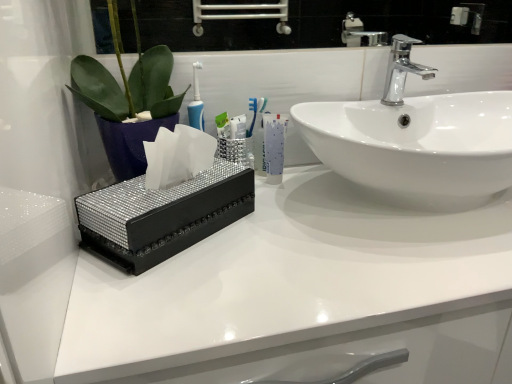
Locate an element on the screen. black glossy tissue box at center is located at coordinates (284, 279).

From the image's perspective, who appears lower, white glossy sink at center or polished chrome faucet at upper right?

white glossy sink at center.

Does white glossy sink at center lie behind polished chrome faucet at upper right?

No, white glossy sink at center is closer to the camera.

From the picture: Between white glossy sink at center and polished chrome faucet at upper right, which one has more height?

Standing taller between the two is white glossy sink at center.

Is black glossy tissue box at center directly adjacent to polished chrome faucet at upper right?

No, black glossy tissue box at center is not in contact with polished chrome faucet at upper right.

From the image's perspective, which one is positioned higher, black glossy tissue box at center or polished chrome faucet at upper right?

polished chrome faucet at upper right.

How many degrees apart are the facing directions of black glossy tissue box at center and polished chrome faucet at upper right?

They differ by 0.105 degrees in their facing directions.

Is black glossy tissue box at center oriented towards polished chrome faucet at upper right?

No, black glossy tissue box at center is not aimed at polished chrome faucet at upper right.

Does point (170, 332) appear closer or farther from the camera than point (398, 194)?

Point (170, 332) is closer to the camera than point (398, 194).

Looking at the image, does black glossy tissue box at center seem bigger or smaller compared to white glossy sink at center?

Considering their sizes, black glossy tissue box at center takes up more space than white glossy sink at center.

Who is shorter, black glossy tissue box at center or white glossy sink at center?

Standing shorter between the two is white glossy sink at center.

Is white glossy sink at center positioned far away from white glossy mouthwash at center?

No.

Does white glossy sink at center have a lesser width compared to white glossy mouthwash at center?

In fact, white glossy sink at center might be wider than white glossy mouthwash at center.

Between white glossy sink at center and white glossy mouthwash at center, which one has larger size?

With larger size is white glossy sink at center.

From the picture: Is sparkly black tissue box at center a part of polished chrome faucet at upper right?

No, polished chrome faucet at upper right does not contain sparkly black tissue box at center.

Who is shorter, polished chrome faucet at upper right or sparkly black tissue box at center?

Standing shorter between the two is polished chrome faucet at upper right.

From the image's perspective, between polished chrome faucet at upper right and sparkly black tissue box at center, who is located below?

sparkly black tissue box at center, from the image's perspective.

Which object is further away from the camera taking this photo, polished chrome faucet at upper right or black glossy tissue box at center?

polished chrome faucet at upper right is further from the camera.

Is black glossy tissue box at center at the back of polished chrome faucet at upper right?

No, black glossy tissue box at center is not at the back of polished chrome faucet at upper right.

Can you confirm if polished chrome faucet at upper right is positioned to the left of black glossy tissue box at center?

Correct, you'll find polished chrome faucet at upper right to the left of black glossy tissue box at center.

Is white glossy mouthwash at center oriented towards sparkly black tissue box at center?

No.

Is sparkly black tissue box at center inside white glossy mouthwash at center?

No, sparkly black tissue box at center is located outside of white glossy mouthwash at center.

Does white glossy mouthwash at center come in front of sparkly black tissue box at center?

No, it is behind sparkly black tissue box at center.

Where is `sink in front of the polished chrome faucet at upper right`? The image size is (512, 384). sink in front of the polished chrome faucet at upper right is located at coordinates (416, 139).

The image size is (512, 384). I want to click on counter top that appears below the polished chrome faucet at upper right (from the image's perspective), so click(284, 279).

When comparing their distances from polished chrome faucet at upper right, does white glossy sink at center or black glossy tissue box at center seem closer?

Based on the image, white glossy sink at center appears to be nearer to polished chrome faucet at upper right.

Considering their positions, is black glossy tissue box at center positioned further to white glossy sink at center than sparkly black tissue box at center?

Based on the image, sparkly black tissue box at center appears to be further to white glossy sink at center.

When comparing their distances from white glossy sink at center, does sparkly black tissue box at center or white glossy mouthwash at center seem further?

sparkly black tissue box at center.

When comparing their distances from polished chrome faucet at upper right, does sparkly black tissue box at center or white glossy sink at center seem closer?

white glossy sink at center lies closer to polished chrome faucet at upper right than the other object.

When comparing their distances from polished chrome faucet at upper right, does black glossy tissue box at center or white glossy sink at center seem further?

Based on the image, black glossy tissue box at center appears to be further to polished chrome faucet at upper right.

Looking at the image, which one is located further to black glossy tissue box at center, white glossy sink at center or polished chrome faucet at upper right?

Among the two, polished chrome faucet at upper right is located further to black glossy tissue box at center.

Considering their positions, is polished chrome faucet at upper right positioned closer to sparkly black tissue box at center than black glossy tissue box at center?

black glossy tissue box at center is closer to sparkly black tissue box at center.

Which object lies nearer to the anchor point white glossy mouthwash at center, sparkly black tissue box at center or polished chrome faucet at upper right?

sparkly black tissue box at center is closer to white glossy mouthwash at center.

Identify the location of sink that lies between white glossy mouthwash at center and black glossy tissue box at center from top to bottom. This screenshot has width=512, height=384. (416, 139).

The image size is (512, 384). In order to click on tap located between sparkly black tissue box at center and white glossy sink at center in the left-right direction in this screenshot , I will do `click(402, 69)`.

I want to click on mouthwash between polished chrome faucet at upper right and black glossy tissue box at center in the vertical direction, so click(x=274, y=146).

Where is `box between polished chrome faucet at upper right and black glossy tissue box at center from top to bottom`? This screenshot has height=384, width=512. box between polished chrome faucet at upper right and black glossy tissue box at center from top to bottom is located at coordinates (162, 215).